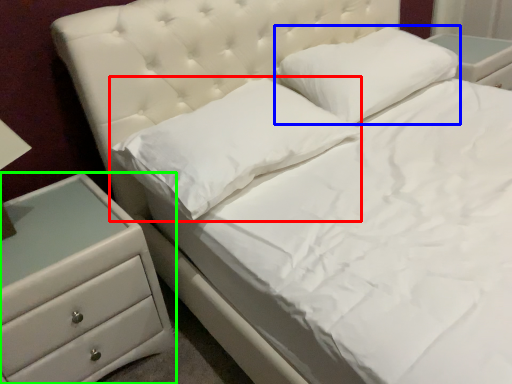
Question: Considering the real-world distances, which object is farthest from pillow (highlighted by a red box)? pillow (highlighted by a blue box) or chest of drawers (highlighted by a green box)?

Choices:
 (A) pillow
 (B) chest of drawers

Answer: (A)